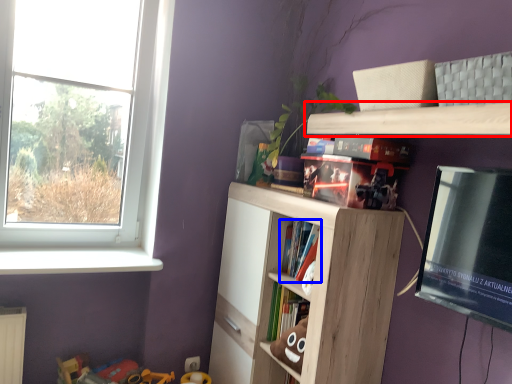
Question: Which object appears farthest to the camera in this image, shelf (highlighted by a red box) or book (highlighted by a blue box)?

Choices:
 (A) shelf
 (B) book

Answer: (B)